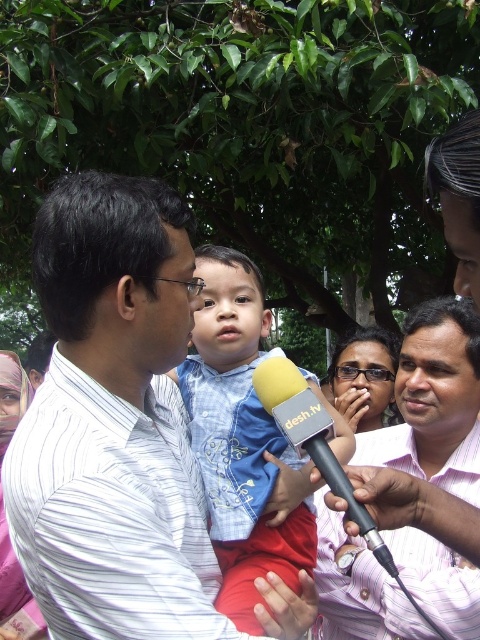
Can you confirm if pink striped shirt at center is bigger than matte black glasses at center?

Correct, pink striped shirt at center is larger in size than matte black glasses at center.

Is point (469, 344) positioned before point (350, 348)?

Yes.

Who is more forward, [416,614] or [347,349]?

Point [416,614] is more forward.

Where is `pink striped shirt at center`? pink striped shirt at center is located at coordinates (433, 401).

Does point (129, 442) come farther from viewer compared to point (352, 588)?

No.

Is white striped shirt at center below pink striped shirt at center?

No, white striped shirt at center is not below pink striped shirt at center.

The height and width of the screenshot is (640, 480). What do you see at coordinates (111, 422) in the screenshot? I see `white striped shirt at center` at bounding box center [111, 422].

Find the location of a particular element. The image size is (480, 640). white striped shirt at center is located at coordinates (111, 422).

Can you confirm if yellow foam microphone at center is wider than matte black glasses at center?

No.

What are the coordinates of `yellow foam microphone at center` in the screenshot? It's located at (312, 440).

You are a GUI agent. You are given a task and a screenshot of the screen. Output one action in this format:
    pyautogui.click(x=<x>, y=<y>)
    Task: Click on the yellow foam microphone at center
    This screenshot has height=640, width=480.
    Given the screenshot: What is the action you would take?
    pyautogui.click(x=312, y=440)